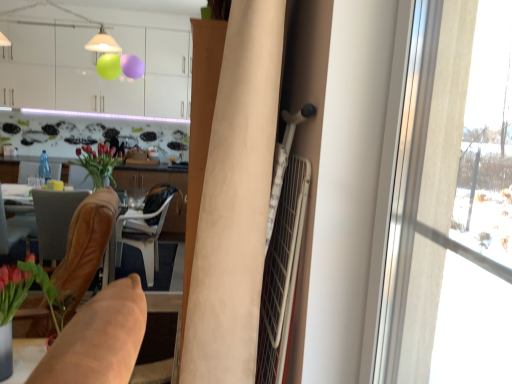
Question: Is green glossy vase at lower left looking in the opposite direction of matte brown vase at center?

Choices:
 (A) yes
 (B) no

Answer: (B)

Question: From a real-world perspective, does green glossy vase at lower left sit lower than matte brown vase at center?

Choices:
 (A) yes
 (B) no

Answer: (A)

Question: Does green glossy vase at lower left appear on the left side of matte brown vase at center?

Choices:
 (A) yes
 (B) no

Answer: (B)

Question: Considering the relative sizes of green glossy vase at lower left and matte brown vase at center in the image provided, is green glossy vase at lower left bigger than matte brown vase at center?

Choices:
 (A) yes
 (B) no

Answer: (B)

Question: Does green glossy vase at lower left have a greater height compared to matte brown vase at center?

Choices:
 (A) yes
 (B) no

Answer: (A)

Question: Considering the relative sizes of green glossy vase at lower left and matte brown vase at center in the image provided, is green glossy vase at lower left shorter than matte brown vase at center?

Choices:
 (A) no
 (B) yes

Answer: (A)

Question: Considering the relative sizes of transparent glass window at right and transparent glass bottle at center in the image provided, is transparent glass window at right smaller than transparent glass bottle at center?

Choices:
 (A) no
 (B) yes

Answer: (A)

Question: Is transparent glass bottle at center completely or partially inside transparent glass window at right?

Choices:
 (A) yes
 (B) no

Answer: (B)

Question: Is transparent glass window at right positioned beyond the bounds of transparent glass bottle at center?

Choices:
 (A) yes
 (B) no

Answer: (A)

Question: Is transparent glass window at right bigger than transparent glass bottle at center?

Choices:
 (A) yes
 (B) no

Answer: (A)

Question: Considering the relative sizes of transparent glass window at right and transparent glass bottle at center in the image provided, is transparent glass window at right shorter than transparent glass bottle at center?

Choices:
 (A) yes
 (B) no

Answer: (B)

Question: Is transparent glass window at right looking in the opposite direction of transparent glass bottle at center?

Choices:
 (A) yes
 (B) no

Answer: (B)

Question: Is the position of white plastic chair at center, which ranks as the 3th chair in front-to-back order, more distant than that of brown leather chair at lower left, which is the second chair from back to front?

Choices:
 (A) yes
 (B) no

Answer: (A)